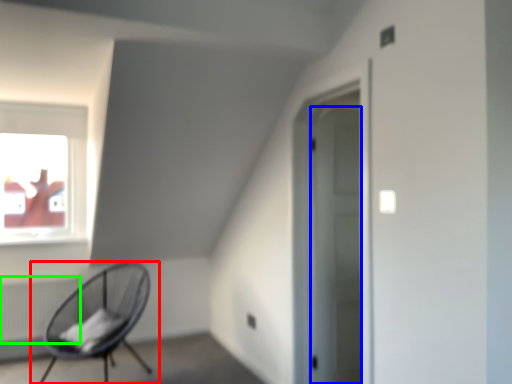
Question: Which object is positioned farthest from chair (highlighted by a red box)? Select from door (highlighted by a blue box) and radiator (highlighted by a green box).

Choices:
 (A) door
 (B) radiator

Answer: (A)